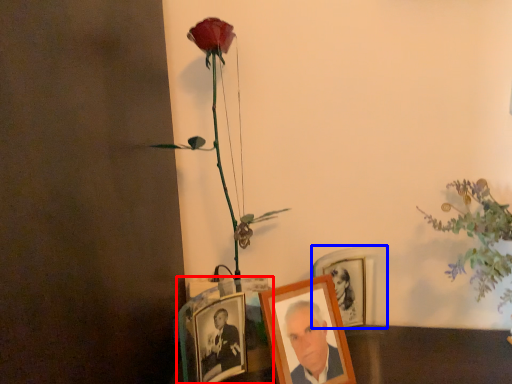
Question: Which object is closer to the camera taking this photo, picture frame (highlighted by a red box) or picture frame (highlighted by a blue box)?

Choices:
 (A) picture frame
 (B) picture frame

Answer: (A)